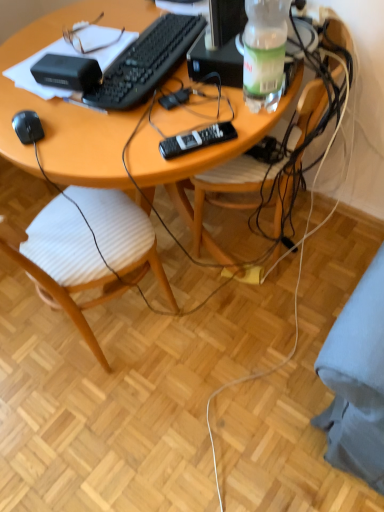
Where is `vacant space in between wooden chair at center, marked as the 2th chair in a left-to-right arrangement, and wooden desk at center`? vacant space in between wooden chair at center, marked as the 2th chair in a left-to-right arrangement, and wooden desk at center is located at coordinates (268, 300).